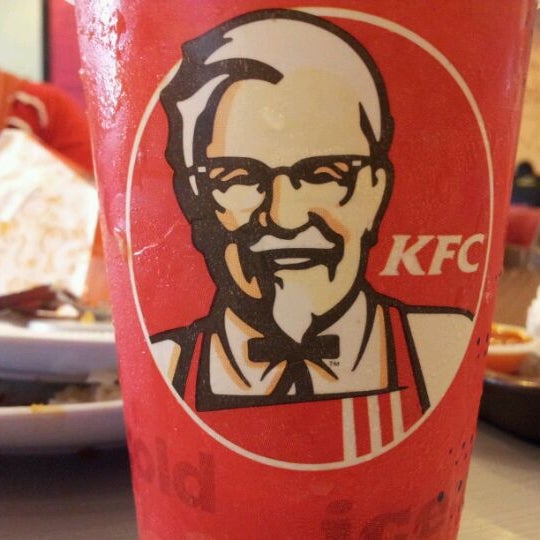
Locate an element on the screen. plates is located at coordinates (70, 424), (64, 363).